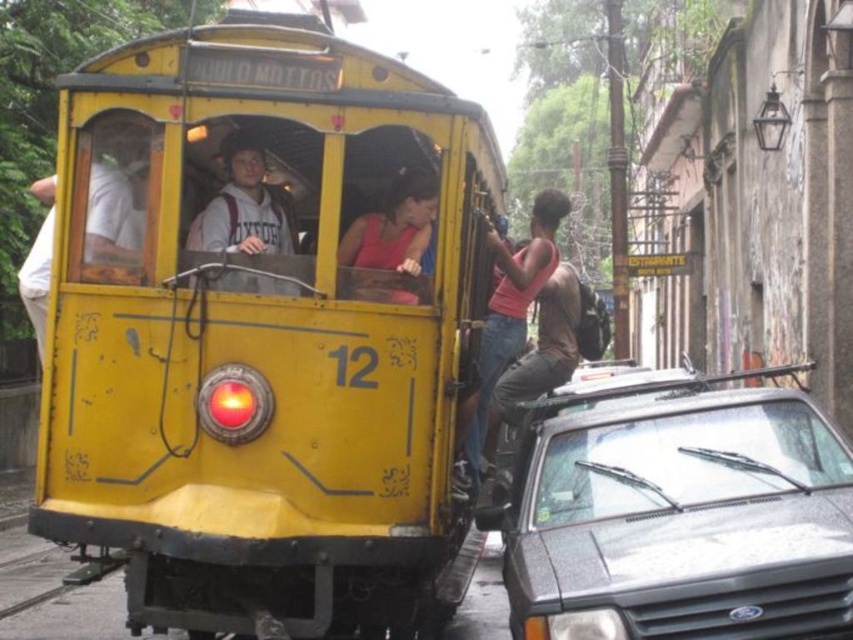
Can you confirm if yellow matte school bus at center is bigger than pink fabric tank top at upper right?

Yes, yellow matte school bus at center is bigger than pink fabric tank top at upper right.

Which of these two, yellow matte school bus at center or pink fabric tank top at upper right, stands taller?

With more height is yellow matte school bus at center.

This screenshot has height=640, width=853. What do you see at coordinates (262, 333) in the screenshot?
I see `yellow matte school bus at center` at bounding box center [262, 333].

This screenshot has height=640, width=853. Identify the location of yellow matte school bus at center. (262, 333).

Is yellow matte school bus at center positioned before matte gray hoodie at center?

Yes, yellow matte school bus at center is in front of matte gray hoodie at center.

Does yellow matte school bus at center have a lesser width compared to matte gray hoodie at center?

No, yellow matte school bus at center is not thinner than matte gray hoodie at center.

Describe the element at coordinates (262, 333) in the screenshot. This screenshot has width=853, height=640. I see `yellow matte school bus at center` at that location.

Find the location of a particular element. yellow matte school bus at center is located at coordinates (262, 333).

Can you confirm if black matte car at lower right is smaller than matte pink tank top at center?

Actually, black matte car at lower right might be larger than matte pink tank top at center.

Is black matte car at lower right shorter than matte pink tank top at center?

In fact, black matte car at lower right may be taller than matte pink tank top at center.

Locate an element on the screen. The image size is (853, 640). black matte car at lower right is located at coordinates (677, 513).

At what (x,y) coordinates should I click in order to perform the action: click on black matte car at lower right. Please return your answer as a coordinate pair (x, y). The image size is (853, 640). Looking at the image, I should click on (677, 513).